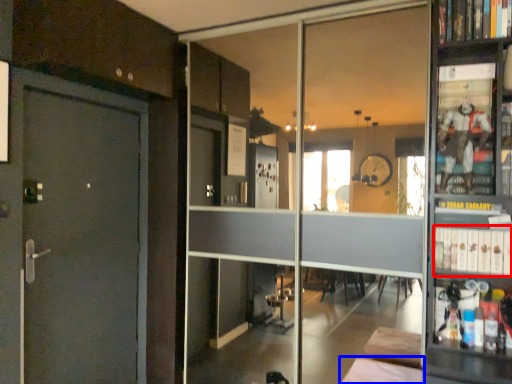
Question: Which object appears farthest to the camera in this image, book (highlighted by a red box) or furniture (highlighted by a blue box)?

Choices:
 (A) book
 (B) furniture

Answer: (A)